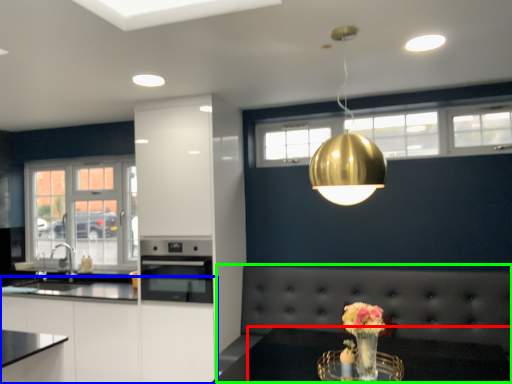
Question: Which is nearer to the table (highlighted by a red box)? cabinetry (highlighted by a blue box) or couch (highlighted by a green box).

Choices:
 (A) cabinetry
 (B) couch

Answer: (B)